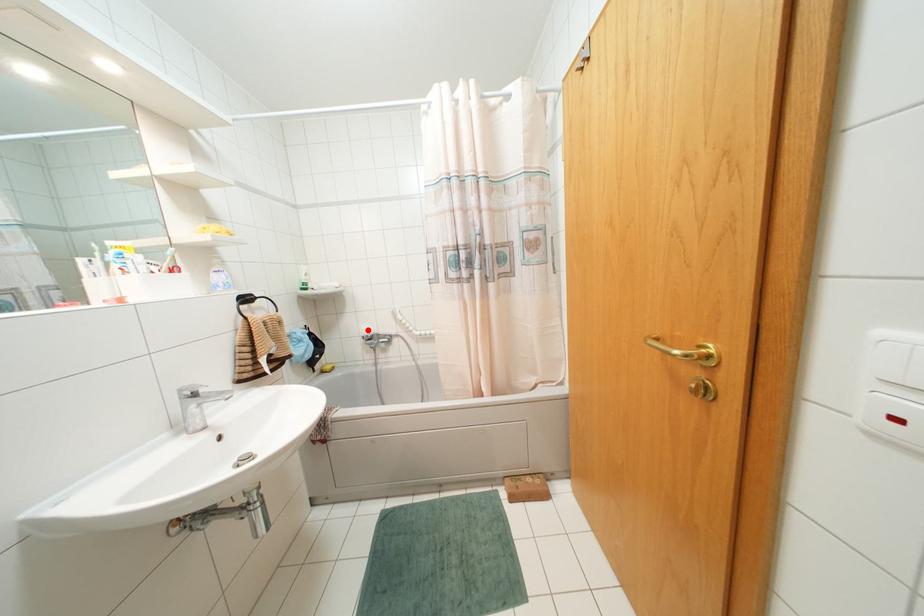
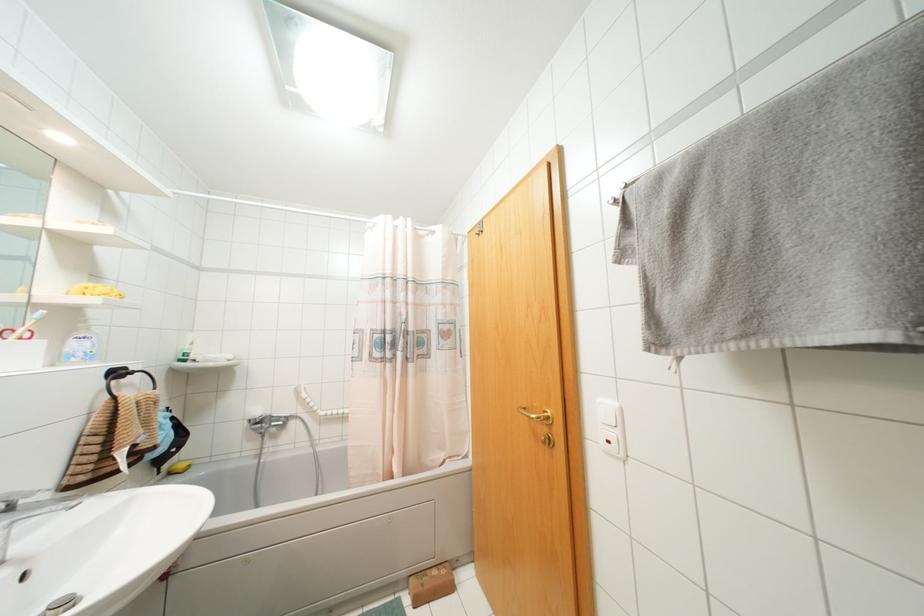
Locate, in the second image, the point that corresponds to the highlighted location in the first image.

(258, 411)